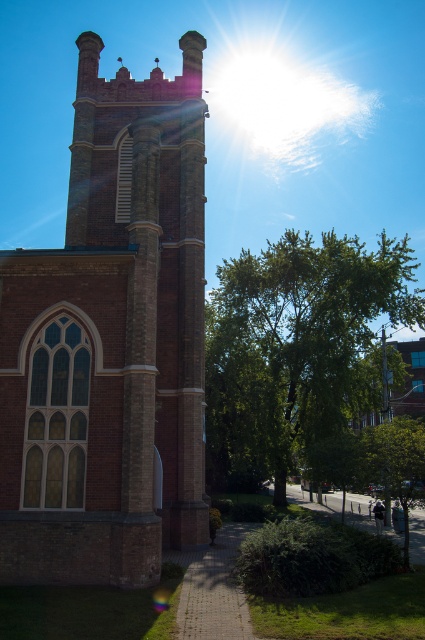
Question: Which of the following is the farthest from the observer?

Choices:
 (A) (238, 420)
 (B) (25, 493)

Answer: (A)

Question: Is brick tower at left positioned at the back of green leafy tree at center?

Choices:
 (A) no
 (B) yes

Answer: (A)

Question: Does brick tower at left appear on the right side of green leafy tree at center?

Choices:
 (A) yes
 (B) no

Answer: (B)

Question: Is the position of brick tower at left less distant than that of green leafy tree at center?

Choices:
 (A) yes
 (B) no

Answer: (A)